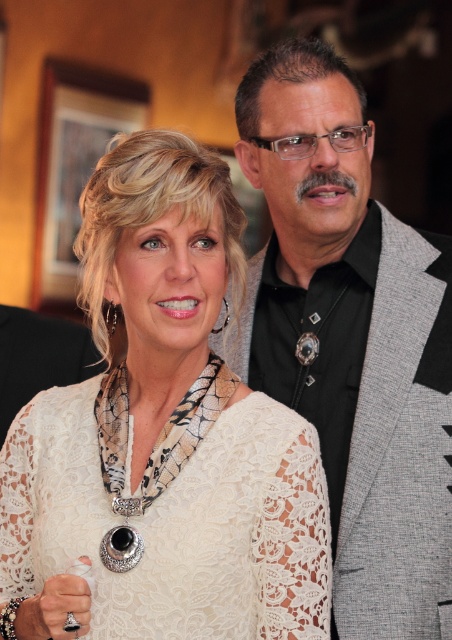
Which is below, white lace dress at center or gray textured suit at right?

white lace dress at center is below.

From the picture: Is white lace dress at center thinner than gray textured suit at right?

Incorrect, white lace dress at center's width is not less than gray textured suit at right's.

Where is `white lace dress at center`? white lace dress at center is located at coordinates (161, 438).